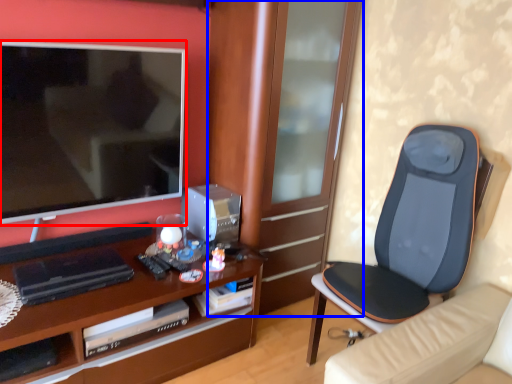
Question: Which of the following is the farthest to the observer, television (highlighted by a red box) or cabinetry (highlighted by a blue box)?

Choices:
 (A) television
 (B) cabinetry

Answer: (B)